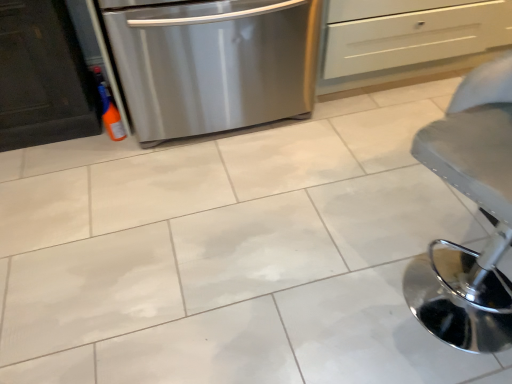
Find the location of `vacant space in between metallic gray stool at lower right and stainless steel dishwasher at left`. vacant space in between metallic gray stool at lower right and stainless steel dishwasher at left is located at coordinates click(314, 189).